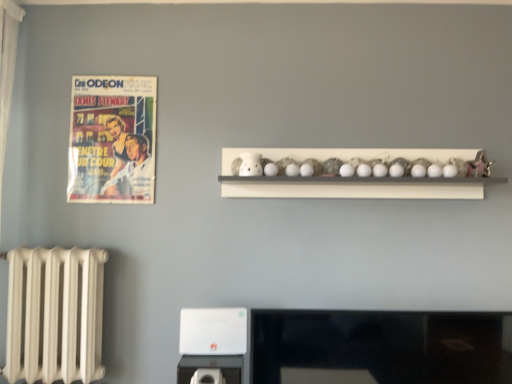
Question: Does white matte shelf at upper center have a lesser width compared to white plastic appliance at lower center?

Choices:
 (A) no
 (B) yes

Answer: (A)

Question: Is white matte shelf at upper center in front of white plastic appliance at lower center?

Choices:
 (A) yes
 (B) no

Answer: (B)

Question: Is white matte shelf at upper center positioned far away from white plastic appliance at lower center?

Choices:
 (A) no
 (B) yes

Answer: (A)

Question: Could white plastic appliance at lower center be considered to be inside white matte shelf at upper center?

Choices:
 (A) yes
 (B) no

Answer: (B)

Question: Can we say white matte shelf at upper center lies outside white plastic appliance at lower center?

Choices:
 (A) no
 (B) yes

Answer: (B)

Question: Is the position of white matte shelf at upper center more distant than that of white plastic appliance at lower center?

Choices:
 (A) no
 (B) yes

Answer: (B)

Question: From the image's perspective, does white plastic appliance at lower center appear higher than white matte shelf at upper center?

Choices:
 (A) no
 (B) yes

Answer: (A)

Question: Is white plastic appliance at lower center facing away from white matte shelf at upper center?

Choices:
 (A) no
 (B) yes

Answer: (A)

Question: Considering the relative sizes of white plastic appliance at lower center and white matte shelf at upper center in the image provided, is white plastic appliance at lower center taller than white matte shelf at upper center?

Choices:
 (A) no
 (B) yes

Answer: (A)

Question: From a real-world perspective, is white plastic appliance at lower center positioned over white matte shelf at upper center based on gravity?

Choices:
 (A) yes
 (B) no

Answer: (B)

Question: Is white plastic appliance at lower center beside white matte shelf at upper center?

Choices:
 (A) yes
 (B) no

Answer: (B)

Question: Can you confirm if white plastic appliance at lower center is positioned to the left of white matte shelf at upper center?

Choices:
 (A) yes
 (B) no

Answer: (A)

Question: Considering the relative positions of white matte shelf at upper center and matte paper poster at upper left in the image provided, is white matte shelf at upper center to the left of matte paper poster at upper left from the viewer's perspective?

Choices:
 (A) no
 (B) yes

Answer: (A)